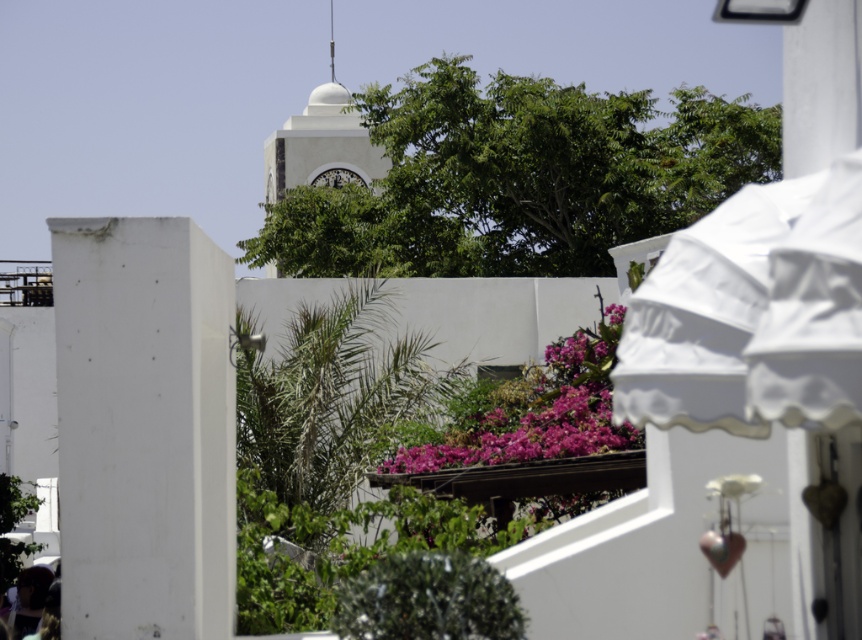
You are standing in the scene and want to take a photo of both the white wall with decorative scalloped edge and the white umbrella with scalloped edge. Which point, point[183,627] or point[275,154], is closer to your current position?

Point[183,627] is closer to the camera than point[275,154], so it is closer to your current position.

You are standing in the scene and want to take a photo of the white smooth clock tower at center. However, the pink matte flowers at center are blocking your view. Which direction should you move to get a clear shot of the clock tower?

Move to the left of the pink matte flowers at center to get a clear view of the white smooth clock tower at center since the flowers are positioned to the right of the clock tower.